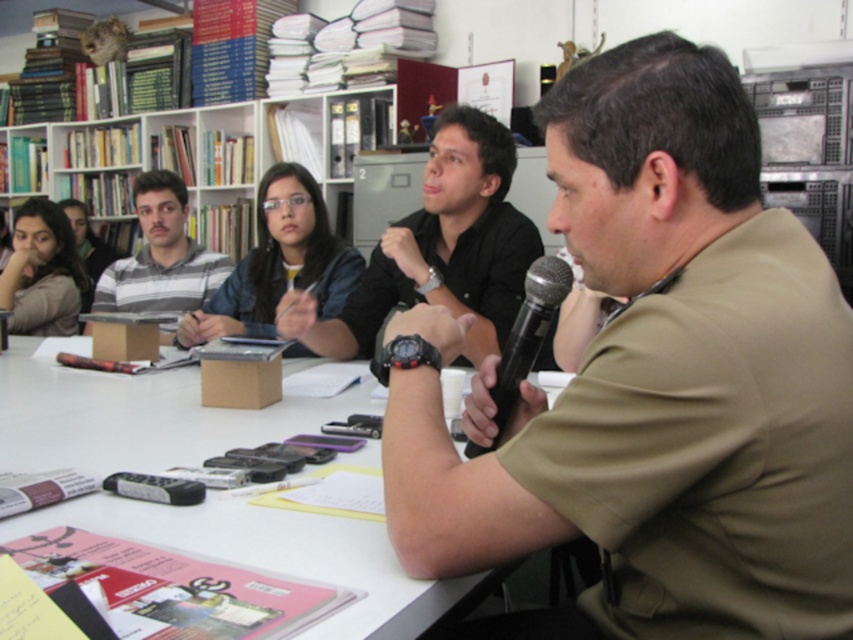
Question: Observing the image, what is the correct spatial positioning of white paper at center in reference to matte black hair at upper left?

Choices:
 (A) above
 (B) below

Answer: (B)

Question: Is black matte shirt at center positioned at the back of striped cotton shirt at left?

Choices:
 (A) yes
 (B) no

Answer: (B)

Question: Which of the following is the farthest from the observer?

Choices:
 (A) black metallic microphone at center
 (B) matte black hair at upper left

Answer: (B)

Question: Does khaki shirt at center have a larger size compared to black metallic microphone at center?

Choices:
 (A) yes
 (B) no

Answer: (A)

Question: Which object appears closest to the camera in this image?

Choices:
 (A) striped cotton shirt at left
 (B) black matte shirt at center
 (C) matte black hair at upper left

Answer: (B)

Question: Which object is the closest to the khaki shirt at center?

Choices:
 (A) denim jacket at center
 (B) white paper at center
 (C) striped cotton shirt at left

Answer: (B)